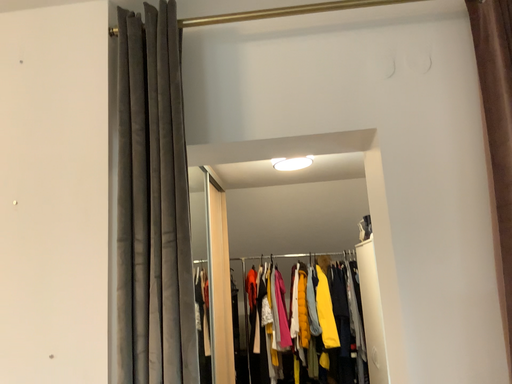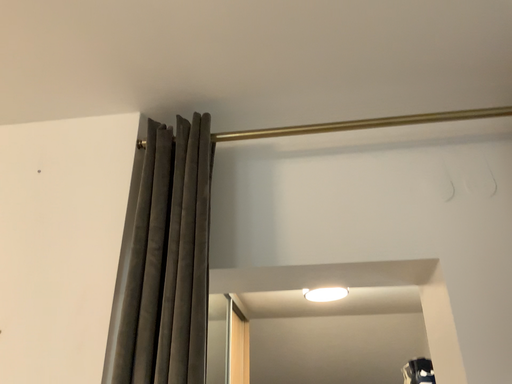
Question: Which way did the camera rotate in the video?

Choices:
 (A) rotated downward
 (B) rotated upward

Answer: (B)